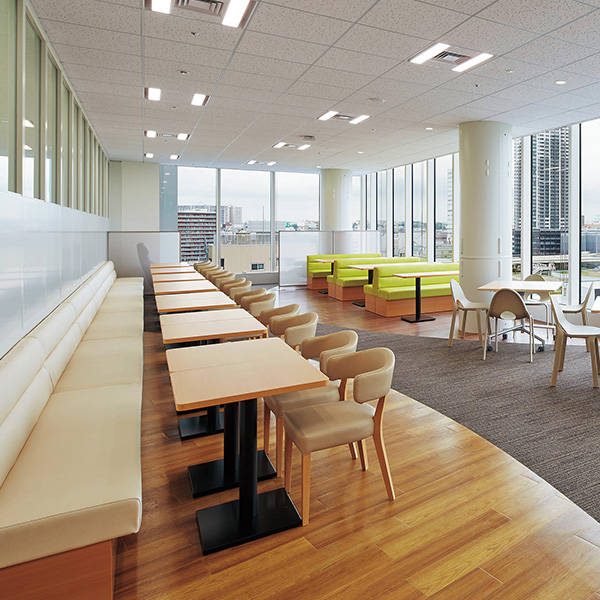
The image size is (600, 600). Find the location of `ventilation`. ventilation is located at coordinates (205, 10), (449, 55), (342, 114), (162, 132), (290, 144).